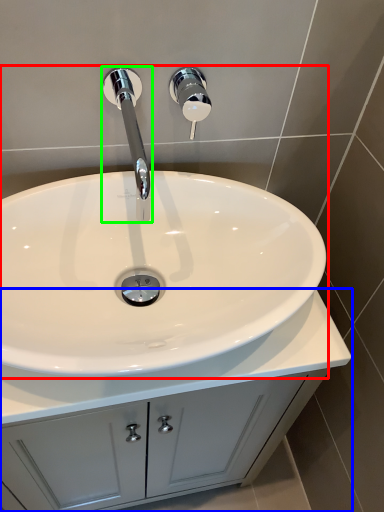
Question: Which object is the closest to the sink (highlighted by a red box)? Choose among these: bathroom cabinet (highlighted by a blue box) or tap (highlighted by a green box).

Choices:
 (A) bathroom cabinet
 (B) tap

Answer: (B)